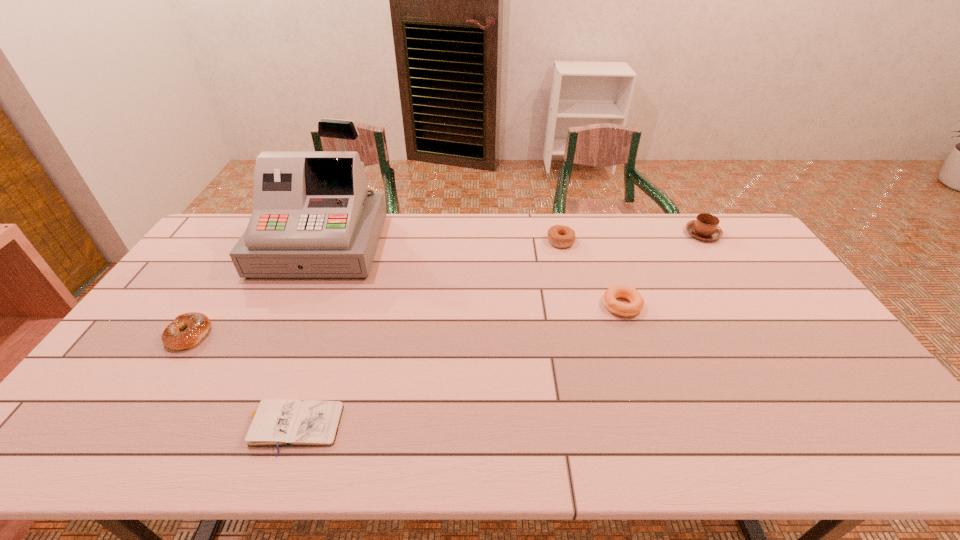
This screenshot has height=540, width=960. I want to click on bagel identified as the closest to the fifth object from left to right, so pyautogui.click(x=559, y=236).

The height and width of the screenshot is (540, 960). In order to click on vacant space that satisfies the following two spatial constraints: 1. on the back side of the rightmost bagel; 2. on the left side of the leftmost bagel in this screenshot , I will do `click(208, 306)`.

Where is `vacant space that satisfies the following two spatial constraints: 1. on the back side of the farthest bagel; 2. on the left side of the leftmost bagel`? The width and height of the screenshot is (960, 540). vacant space that satisfies the following two spatial constraints: 1. on the back side of the farthest bagel; 2. on the left side of the leftmost bagel is located at coordinates (251, 241).